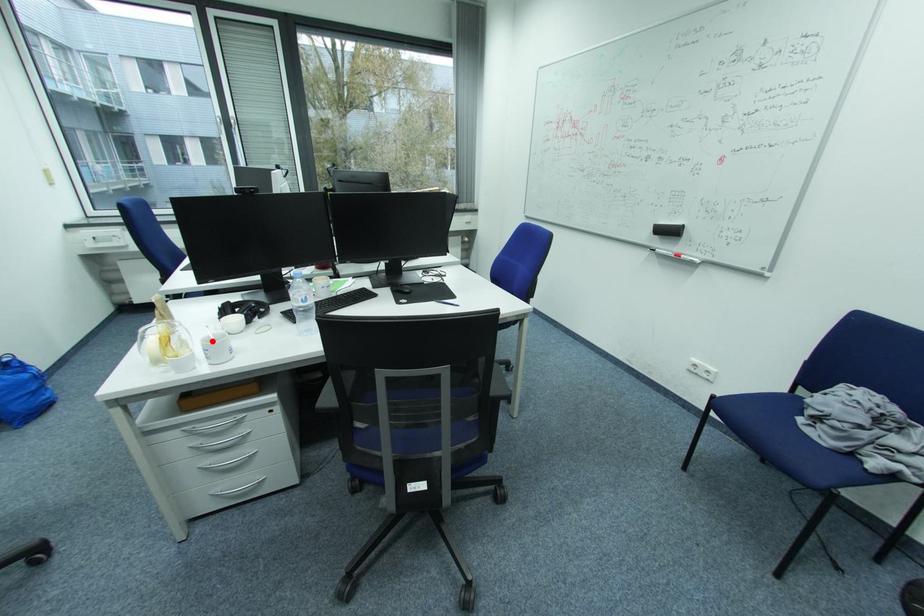
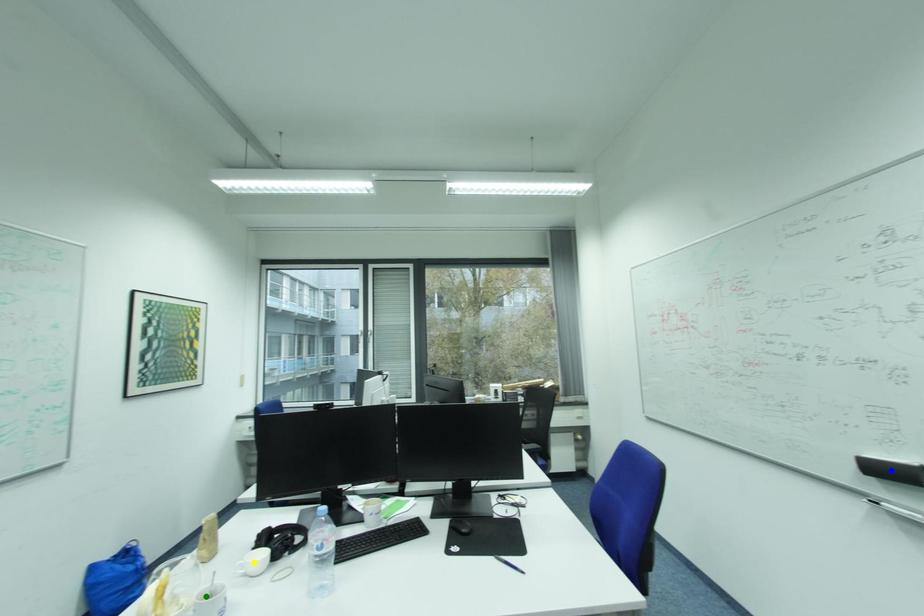
Question: I am providing you with two images of the same scene from different viewpoints. A red point is marked on the first image. You are given multiple points on the second image. Which mark in image 2 goes with the point in image 1?

Choices:
 (A) yellow point
 (B) blue point
 (C) green point

Answer: (C)